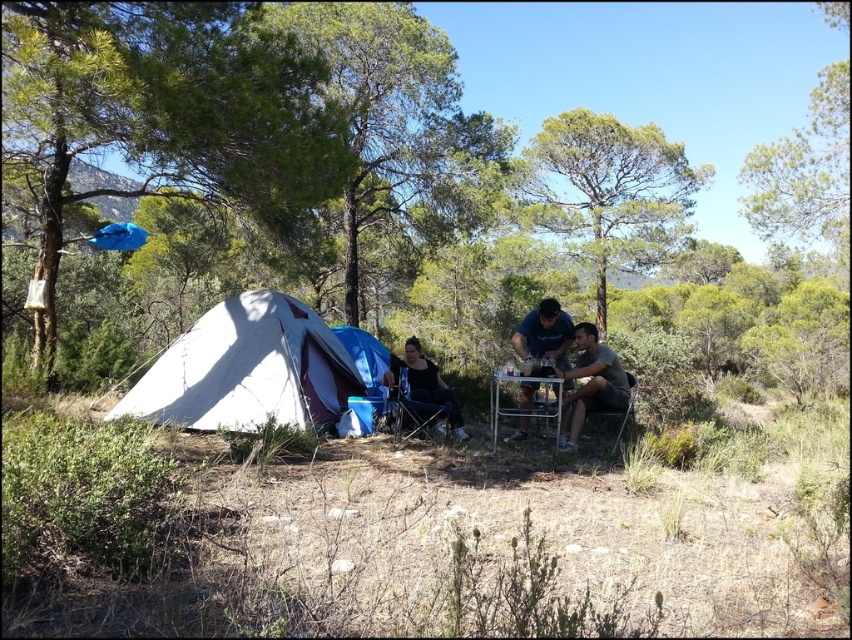
Question: Estimate the real-world distances between objects in this image. Which object is closer to the white fabric tent at center?

Choices:
 (A) metallic silver table at center
 (B) blue fabric chair at center

Answer: (A)

Question: Can you confirm if white fabric tent at center is bigger than metallic silver chair at center?

Choices:
 (A) no
 (B) yes

Answer: (B)

Question: Is green leafy tree at left positioned behind white fabric tent at center?

Choices:
 (A) no
 (B) yes

Answer: (A)

Question: Estimate the real-world distances between objects in this image. Which object is farther from the black mesh chair at center?

Choices:
 (A) green leafy tree at center
 (B) green fabric chair at center
 (C) metallic silver table at center

Answer: (A)

Question: Estimate the real-world distances between objects in this image. Which object is farther from the green leafy tree at left?

Choices:
 (A) metallic silver chair at center
 (B) metallic silver table at center
 (C) black mesh chair at center
 (D) white fabric tent at center

Answer: (A)

Question: Does green leafy tree at left appear over metallic silver chair at center?

Choices:
 (A) yes
 (B) no

Answer: (A)